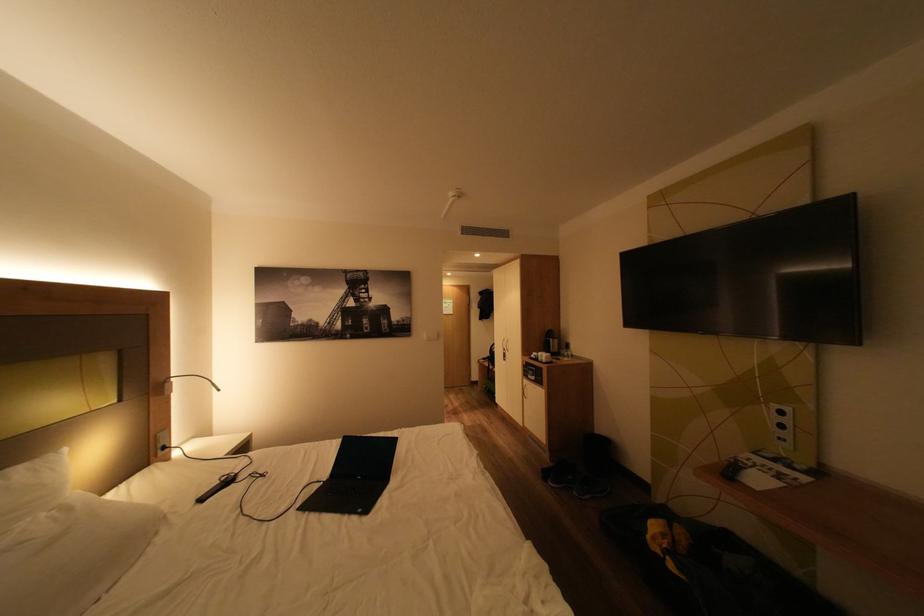
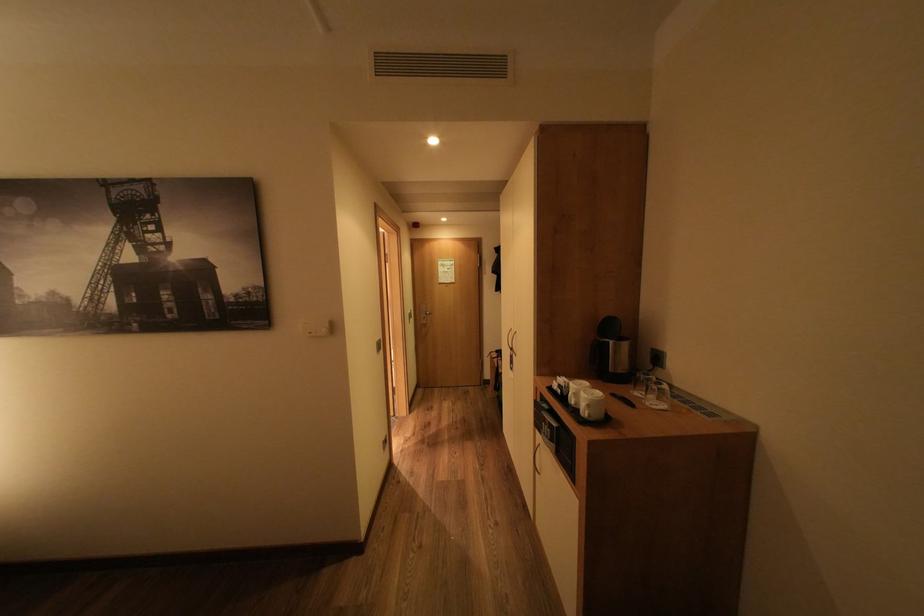
Find the pixel in the second image that matches point (576, 360) in the first image.

(664, 402)